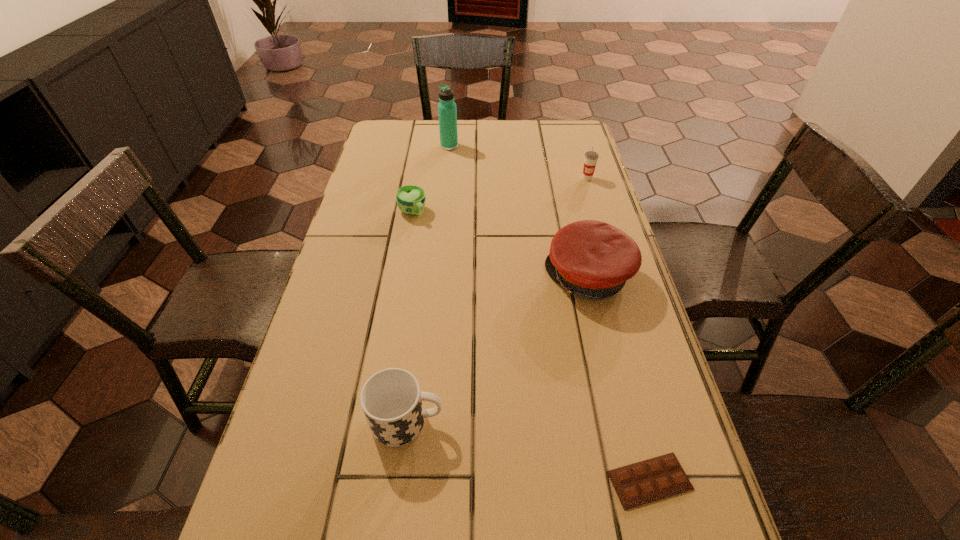
This screenshot has height=540, width=960. Identify the location of vacant space situated 0.250m on the front of the tallest object. (444, 193).

At what (x,y) coordinates should I click in order to perform the action: click on vacant space located on the side of the rightmost cup with the logo. Please return your answer as a coordinate pair (x, y). The width and height of the screenshot is (960, 540). Looking at the image, I should click on (610, 253).

You are a GUI agent. You are given a task and a screenshot of the screen. Output one action in this format:
    pyautogui.click(x=<x>, y=<y>)
    Task: Click on the vacant region located at the front of the cap where the visor is located
    The image size is (960, 540).
    Given the screenshot: What is the action you would take?
    pyautogui.click(x=502, y=277)

Identify the location of free space located at the front of the cap where the visor is located. (386, 277).

This screenshot has height=540, width=960. In order to click on free space located 0.170m at the front of the cap where the visor is located in this screenshot , I will do `click(478, 277)`.

Image resolution: width=960 pixels, height=540 pixels. I want to click on free space located on the side of the nearest cup with the handle, so click(x=507, y=421).

Where is `vacant region located on the right of the second farthest cup`? The width and height of the screenshot is (960, 540). vacant region located on the right of the second farthest cup is located at coordinates (489, 212).

At what (x,y) coordinates should I click in order to perform the action: click on object at the far edge. Please return your answer as a coordinate pair (x, y). Looking at the image, I should click on coord(447,111).

Locate an element on the screen. The height and width of the screenshot is (540, 960). object located at the left edge is located at coordinates (410, 199).

This screenshot has width=960, height=540. What are the coordinates of `cup that is positioned at the right edge` in the screenshot? It's located at (591, 157).